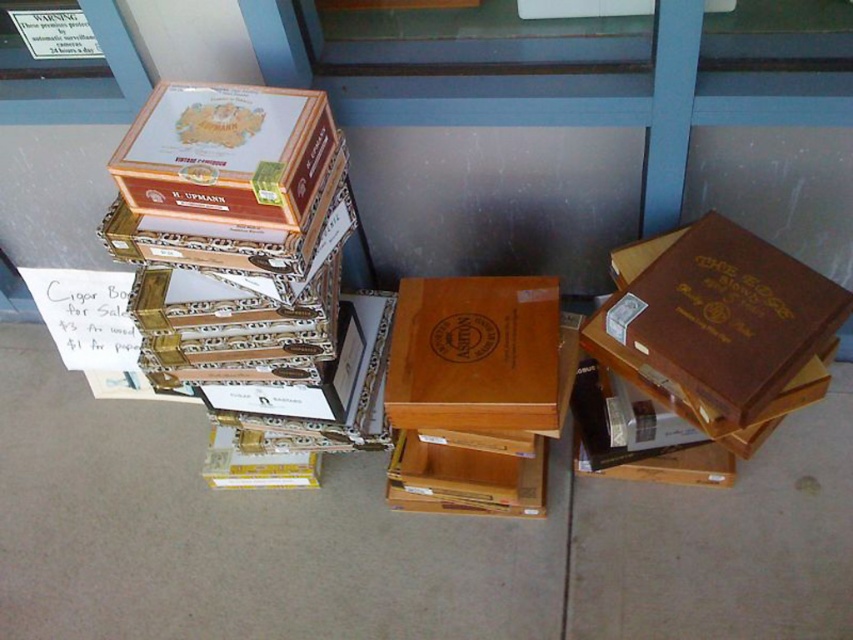
Does brown cardboard boxes at center have a lesser height compared to matte brown cigar box at upper left?

In fact, brown cardboard boxes at center may be taller than matte brown cigar box at upper left.

In the scene shown: Which of these two, brown cardboard boxes at center or matte brown cigar box at upper left, stands shorter?

Standing shorter between the two is matte brown cigar box at upper left.

Is point (412, 627) in front of point (225, 193)?

No.

I want to click on brown cardboard boxes at center, so click(396, 538).

Does brown cardboard boxes at center have a greater height compared to matte brown wooden box at center?

Yes, brown cardboard boxes at center is taller than matte brown wooden box at center.

Between point (589, 588) and point (537, 317), which one is positioned behind?

Point (589, 588)

This screenshot has height=640, width=853. What are the coordinates of `brown cardboard boxes at center` in the screenshot? It's located at (396, 538).

Based on the photo, who is positioned more to the right, brown cardboard boxes at center or wooden box at center?

wooden box at center

Does brown cardboard boxes at center appear under wooden box at center?

Yes, brown cardboard boxes at center is below wooden box at center.

Locate an element on the screen. brown cardboard boxes at center is located at coordinates (396, 538).